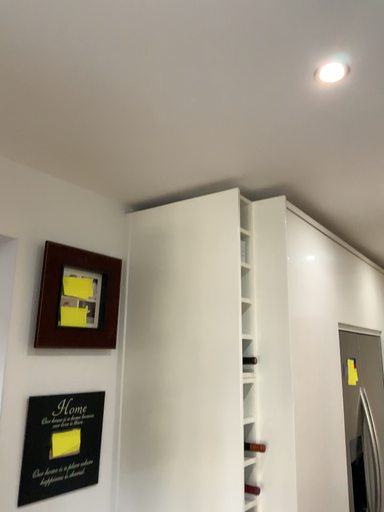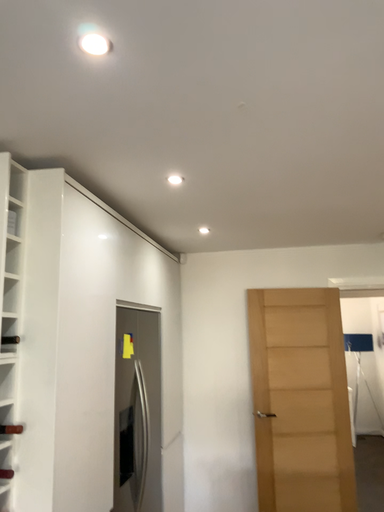
Question: Which way did the camera rotate in the video?

Choices:
 (A) rotated right
 (B) rotated left

Answer: (A)